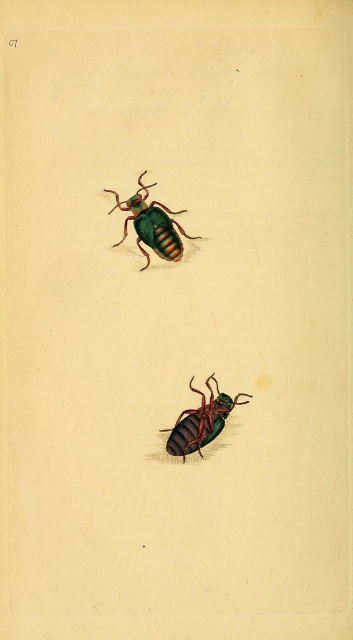
Which is behind, point (133, 224) or point (172, 451)?

Point (133, 224)

Which is in front, point (160, 220) or point (172, 444)?

Point (172, 444)

Image resolution: width=353 pixels, height=640 pixels. In order to click on green glossy beetle at center in this screenshot , I will do `click(152, 225)`.